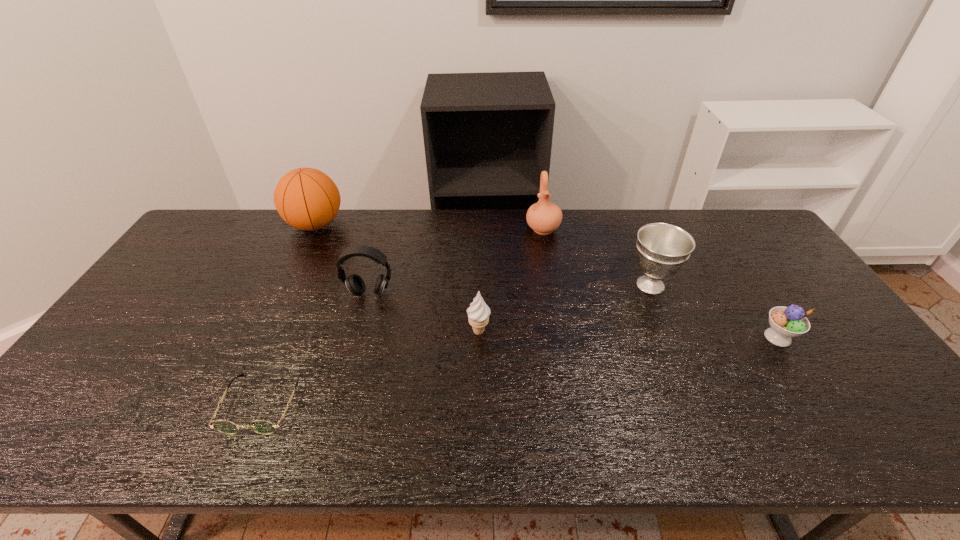
The height and width of the screenshot is (540, 960). Identify the location of basketball. (307, 199).

Where is `the third object from right to left`? The image size is (960, 540). the third object from right to left is located at coordinates (544, 217).

You are a GUI agent. You are given a task and a screenshot of the screen. Output one action in this format:
    pyautogui.click(x=<x>, y=<y>)
    Task: Click on the sixth object from left to right
    The image size is (960, 540).
    Given the screenshot: What is the action you would take?
    pyautogui.click(x=662, y=249)

Image resolution: width=960 pixels, height=540 pixels. I want to click on earphone, so click(x=355, y=284).

Find the location of a particular element. the taller icecream is located at coordinates coord(478,313).

The width and height of the screenshot is (960, 540). I want to click on the fourth object from right to left, so click(478, 313).

The height and width of the screenshot is (540, 960). Find the location of `the shorter icecream`. the shorter icecream is located at coordinates (786, 322).

Find the location of a particular element. The image size is (960, 540). the second shortest object is located at coordinates (786, 322).

This screenshot has width=960, height=540. Find the location of `spectacles`. spectacles is located at coordinates (264, 427).

I want to click on the nearest object, so click(264, 427).